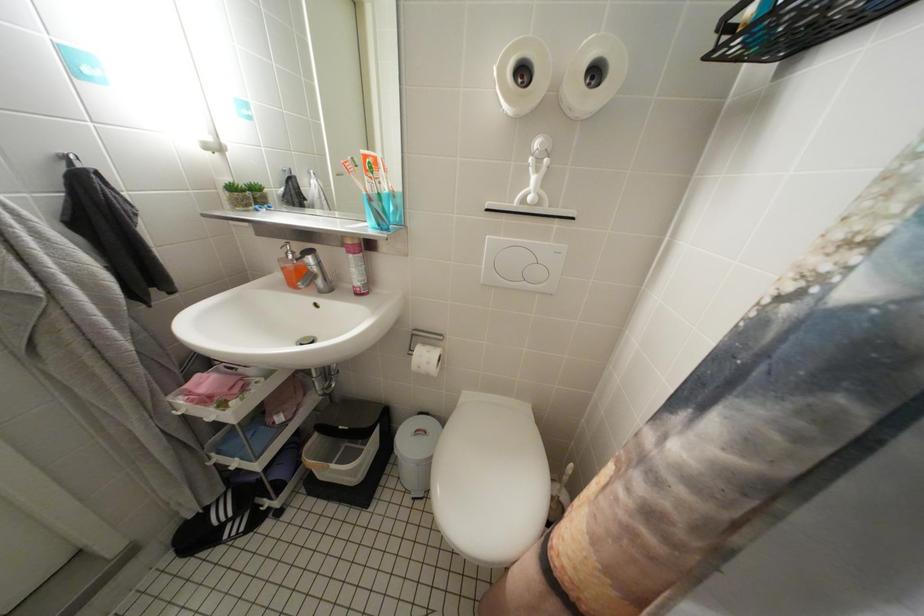
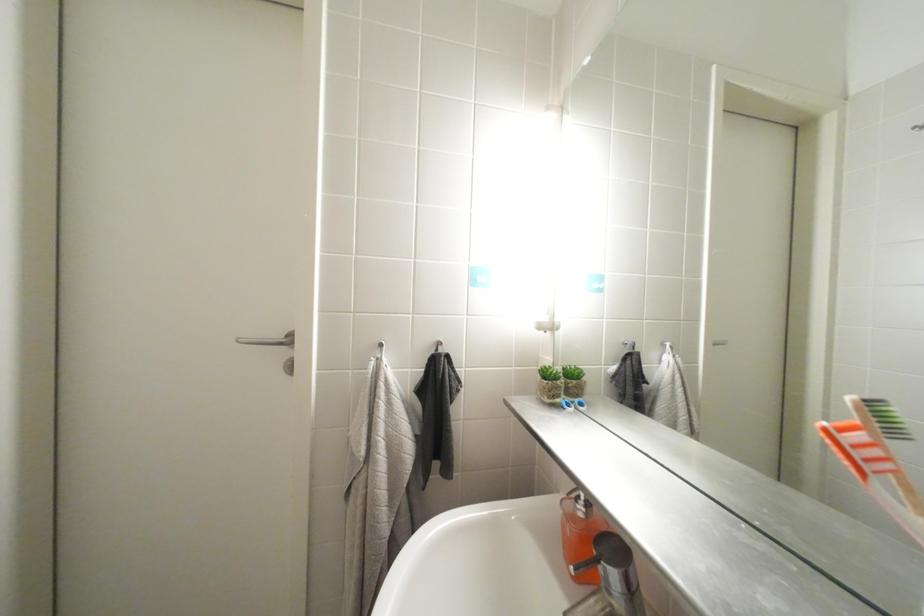
Question: The camera is either moving clockwise (left) or counter-clockwise (right) around the object. The first image is from the beginning of the video and the second image is from the end. Is the camera moving left or right when shooting the video?

Choices:
 (A) Left
 (B) Right

Answer: (B)